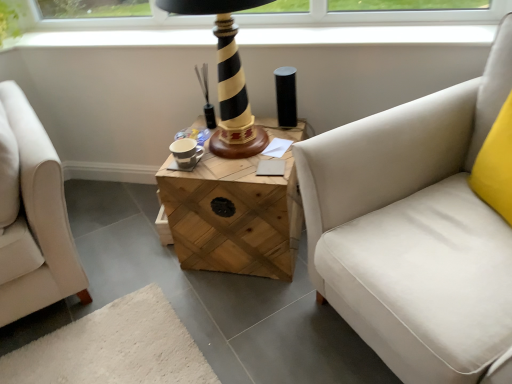
Question: Can you confirm if wooden crate at center is bigger than white fabric studio couch at right?

Choices:
 (A) no
 (B) yes

Answer: (A)

Question: Can you confirm if wooden crate at center is wider than white fabric studio couch at right?

Choices:
 (A) no
 (B) yes

Answer: (A)

Question: Is wooden crate at center thinner than white fabric studio couch at right?

Choices:
 (A) yes
 (B) no

Answer: (A)

Question: Can you confirm if wooden crate at center is positioned to the right of white fabric studio couch at right?

Choices:
 (A) yes
 (B) no

Answer: (B)

Question: Does wooden crate at center appear on the left side of white fabric studio couch at right?

Choices:
 (A) yes
 (B) no

Answer: (A)

Question: Is wooden crate at center oriented towards white fabric studio couch at right?

Choices:
 (A) no
 (B) yes

Answer: (A)

Question: Can you see wooden crate at center touching black striped wood table lamp at center?

Choices:
 (A) no
 (B) yes

Answer: (A)

Question: From the image's perspective, is wooden crate at center beneath black striped wood table lamp at center?

Choices:
 (A) no
 (B) yes

Answer: (B)

Question: Is wooden crate at center closer to camera compared to black striped wood table lamp at center?

Choices:
 (A) yes
 (B) no

Answer: (B)

Question: Considering the relative sizes of wooden crate at center and black striped wood table lamp at center in the image provided, is wooden crate at center taller than black striped wood table lamp at center?

Choices:
 (A) no
 (B) yes

Answer: (A)

Question: Is wooden crate at center facing towards black striped wood table lamp at center?

Choices:
 (A) no
 (B) yes

Answer: (A)

Question: Would you say black striped wood table lamp at center is part of wooden crate at center's contents?

Choices:
 (A) yes
 (B) no

Answer: (B)

Question: Considering the relative sizes of black striped wood table lamp at center and white fabric studio couch at right in the image provided, is black striped wood table lamp at center smaller than white fabric studio couch at right?

Choices:
 (A) yes
 (B) no

Answer: (A)